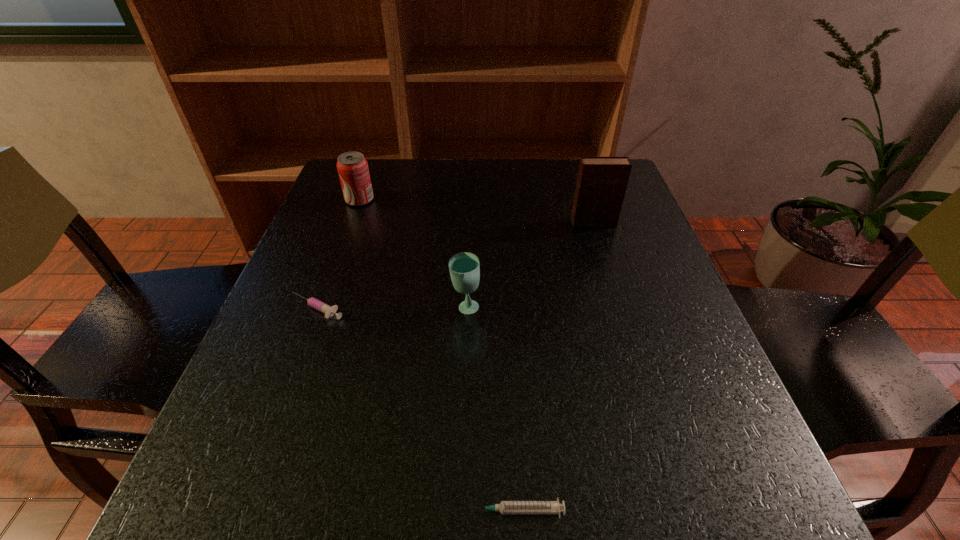
Find the location of a particular element. This screenshot has width=960, height=540. vacant space in between the soda can and the nearest object is located at coordinates (438, 355).

The image size is (960, 540). I want to click on free spot between the rightmost object and the farthest object, so click(476, 211).

The image size is (960, 540). In order to click on free space between the farthest object and the nearest object in this screenshot , I will do `click(438, 355)`.

The image size is (960, 540). I want to click on free area in between the farthest object and the nearer syringe, so click(438, 355).

The width and height of the screenshot is (960, 540). I want to click on free spot between the farthest object and the glass, so click(x=413, y=254).

Find the location of a particular element. blank region between the nearer syringe and the glass is located at coordinates (491, 409).

This screenshot has height=540, width=960. What are the coordinates of `object that stands as the third closest to the nearest object` in the screenshot? It's located at (601, 184).

This screenshot has height=540, width=960. What are the coordinates of `the third closest object to the soda can` in the screenshot? It's located at (601, 184).